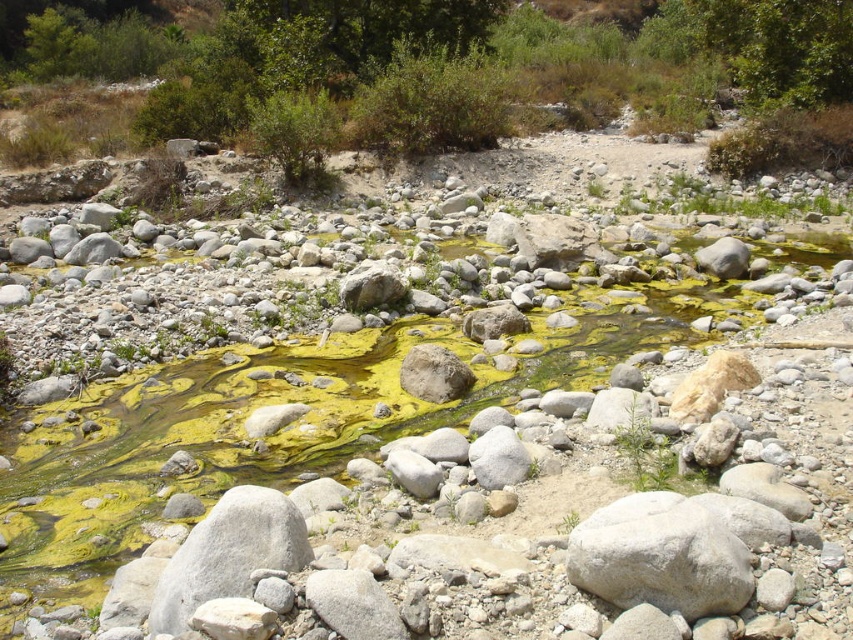
Question: Where is gray/smooth rock at center located in relation to green leafy bush at center in the image?

Choices:
 (A) below
 (B) above

Answer: (A)

Question: Does green leafy bush at upper center appear under green leafy bush at center?

Choices:
 (A) no
 (B) yes

Answer: (A)

Question: Among these objects, which one is farthest from the camera?

Choices:
 (A) green leafy shrubs at upper center
 (B) gray/smooth rock at center
 (C) yellow-green algae at center

Answer: (A)

Question: Estimate the real-world distances between objects in this image. Which object is closer to the gray/smooth rock at center?

Choices:
 (A) green leafy bush at center
 (B) yellow-green algae at center
 (C) green leafy shrubs at upper center
 (D) green leafy bush at upper center

Answer: (B)

Question: Can you confirm if yellow-green algae at center is positioned to the left of green leafy bush at upper center?

Choices:
 (A) yes
 (B) no

Answer: (B)

Question: Which of these objects is positioned closest to the yellow-green algae at center?

Choices:
 (A) green leafy shrubs at upper center
 (B) gray/smooth rock at center
 (C) green leafy bush at upper center
 (D) green leafy bush at center

Answer: (B)